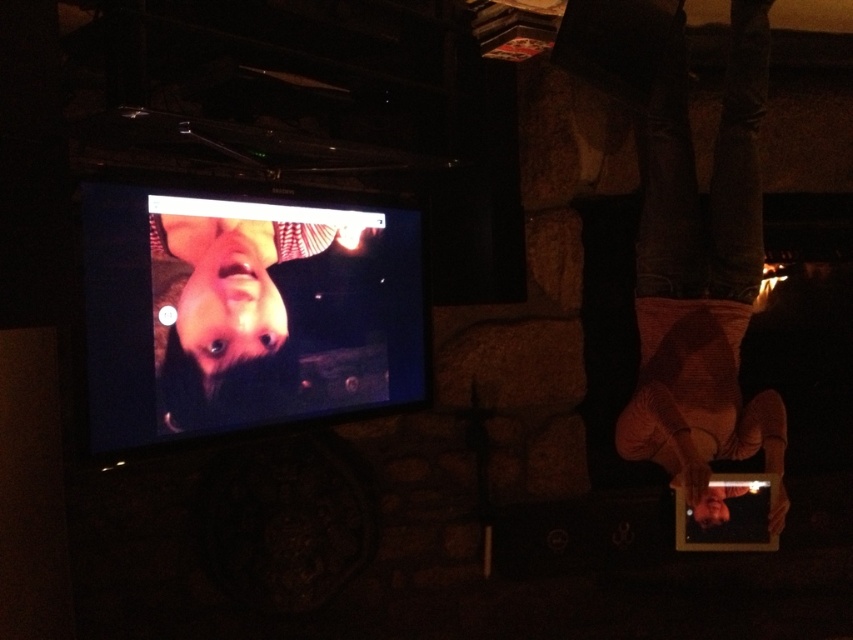
In the scene shown: You are designing a layout for a new app and need to place two icons. The first icon represents the striped sweater at lower right and the second represents the smooth skin face at upper left. If you want the face icon to be wider than the sweater icon, does the current size relationship between the objects in the scene support this design choice?

The striped sweater at lower right is narrower than the smooth skin face at upper left in the scene, so yes, the face icon can be made wider than the sweater icon to match their size relationship.

You are standing in the room and want to place a small plant between the striped sweater at lower right and the smooth skin face at upper left. Based on their positions, where should you place the plant?

The striped sweater at lower right is to the right of the smooth skin face at upper left, so place the plant in the middle between them.